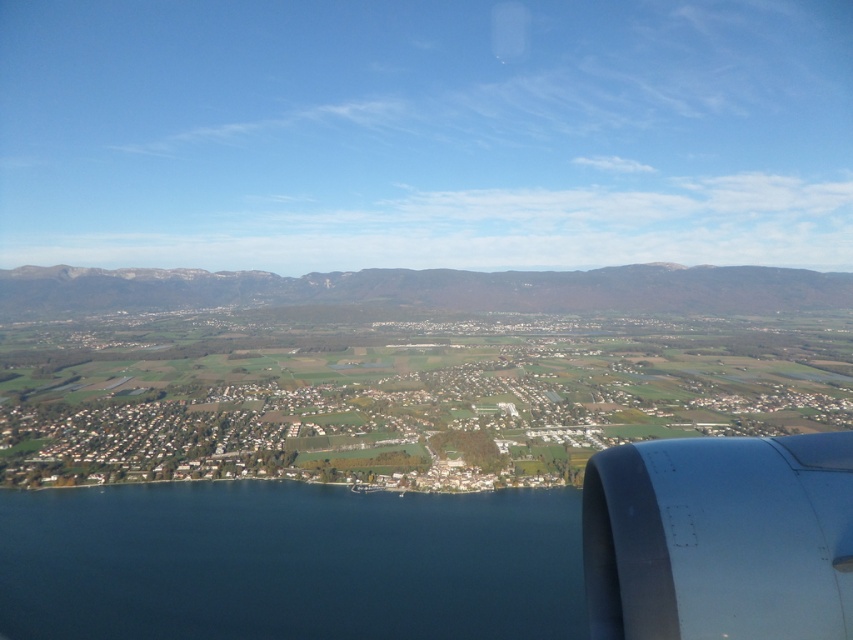
Question: Which point is closer to the camera taking this photo?

Choices:
 (A) (724, 403)
 (B) (665, 481)

Answer: (B)

Question: Which of these objects is positioned farthest from the rocky gray mountains at center?

Choices:
 (A) green grassy town at center
 (B) deep blue water at lower left

Answer: (B)

Question: Which object appears farthest from the camera in this image?

Choices:
 (A) deep blue water at lower left
 (B) green grassy town at center
 (C) metallic gray engine at lower right

Answer: (B)

Question: Is metallic gray engine at lower right wider than rocky gray mountains at center?

Choices:
 (A) no
 (B) yes

Answer: (A)

Question: Can you confirm if green grassy town at center is positioned to the right of deep blue water at lower left?

Choices:
 (A) yes
 (B) no

Answer: (A)

Question: Is green grassy town at center thinner than deep blue water at lower left?

Choices:
 (A) yes
 (B) no

Answer: (B)